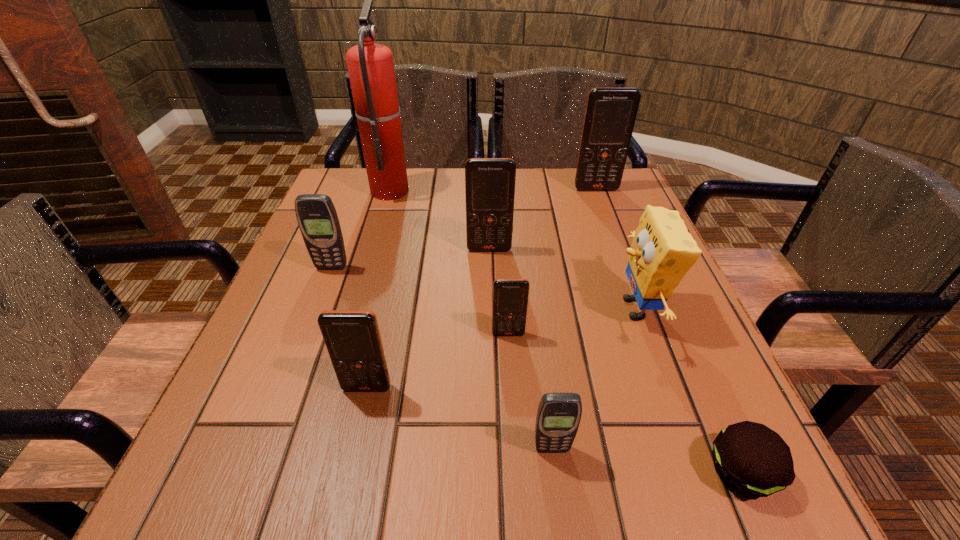
Locate an element on the screen. This screenshot has width=960, height=540. vacant space located 0.330m on the face of the yellow sponge is located at coordinates (443, 308).

The width and height of the screenshot is (960, 540). What are the coordinates of `vacant area located on the face of the yellow sponge` in the screenshot? It's located at (452, 308).

Locate an element on the screen. This screenshot has width=960, height=540. free spot located on the screen of the fourth nearest cellular telephone is located at coordinates 263,448.

The width and height of the screenshot is (960, 540). I want to click on vacant area situated 0.080m on the screen of the leftmost orange cellular telephone, so click(x=356, y=440).

Identify the location of free space located on the screen of the smallest orange cellular telephone. (511, 379).

You are a GUI agent. You are given a task and a screenshot of the screen. Output one action in this format:
    pyautogui.click(x=<x>, y=<y>)
    Task: Click on the vacant area situated on the left of the shortest object
    
    Given the screenshot: What is the action you would take?
    pyautogui.click(x=461, y=471)

This screenshot has height=540, width=960. I want to click on fire extinguisher that is at the far edge, so click(x=370, y=65).

I want to click on cellular telephone that is at the far edge, so click(x=610, y=115).

Where is `cellular telephone positioned at the near edge`? cellular telephone positioned at the near edge is located at coordinates (558, 417).

Find the location of a particular element. patty located at the near edge is located at coordinates (752, 459).